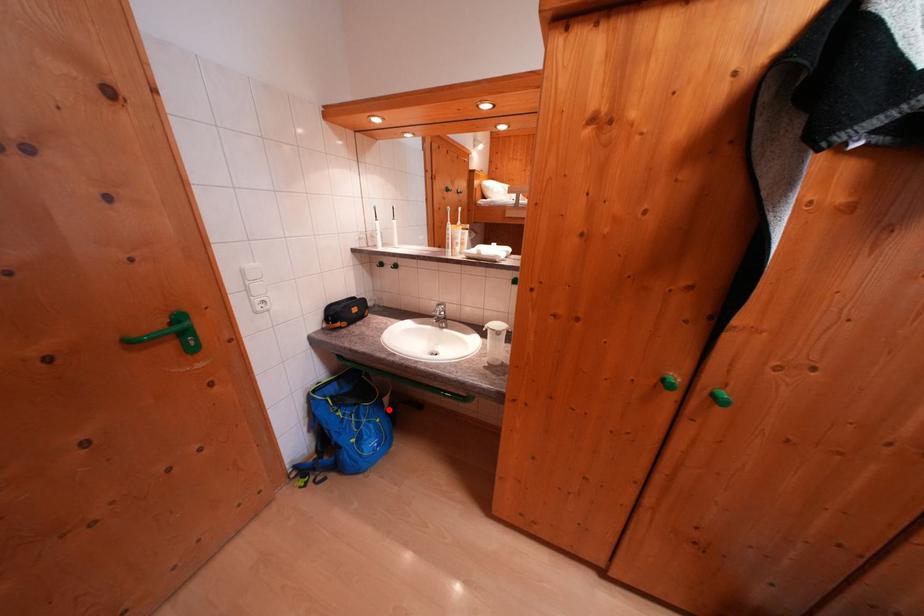
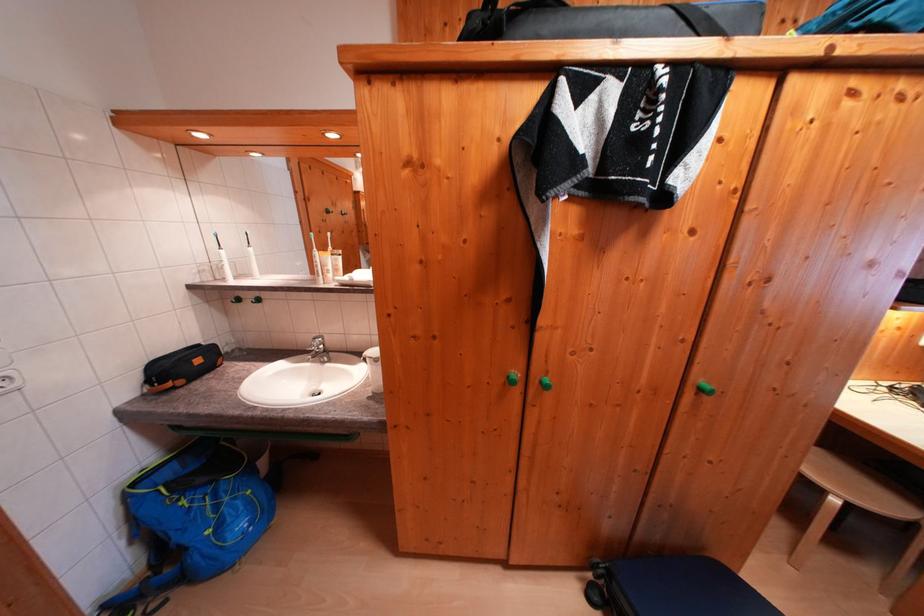
Question: A red point is marked in image1. In image2, is the corresponding 3D point closer to the camera or farther? Reply with the corresponding letter.

Choices:
 (A) The corresponding 3D point is closer.
 (B) The corresponding 3D point is farther.

Answer: (A)